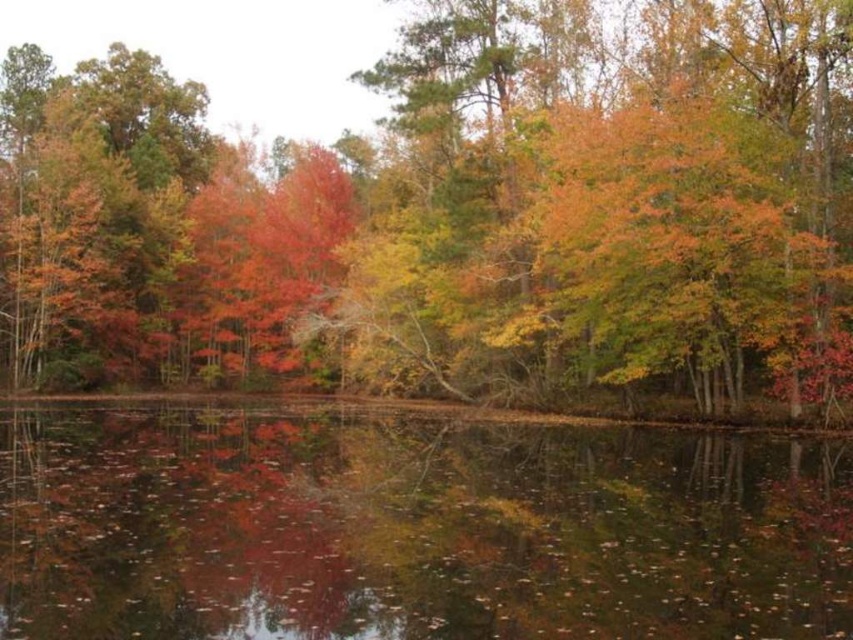
You are an artist trying to paint the autumn scene. You want to ensure the autumn leaves at center and reflective dark water at center are placed correctly. According to the scene, which object should be on the left side?

The autumn leaves at center is positioned on the left side of reflective dark water at center, so the autumn leaves at center should be placed on the left side.

You are an artist planning to paint the autumn scene. You need to decide the vertical positioning of the autumn leaves at center and reflective dark water at center in your painting. Based on the image, which object should be placed higher in the painting?

The autumn leaves at center should be placed higher in the painting since they are much taller than the reflective dark water at center according to the description.

You are an artist planning to paint the autumnal landscape. You want to ensure the autumn leaves at center and reflective dark water at center are proportionally accurate. Which object should you paint wider in your artwork?

The autumn leaves at center should be painted wider than the reflective dark water at center because the autumn leaves at center has a larger width according to the description.